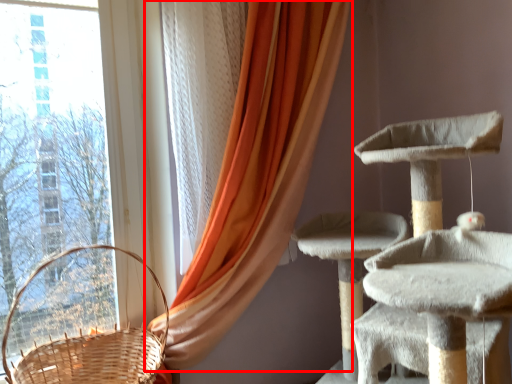
Question: Observing the image, what is the correct spatial positioning of curtain (annotated by the red box) in reference to basket?

Choices:
 (A) right
 (B) left

Answer: (A)